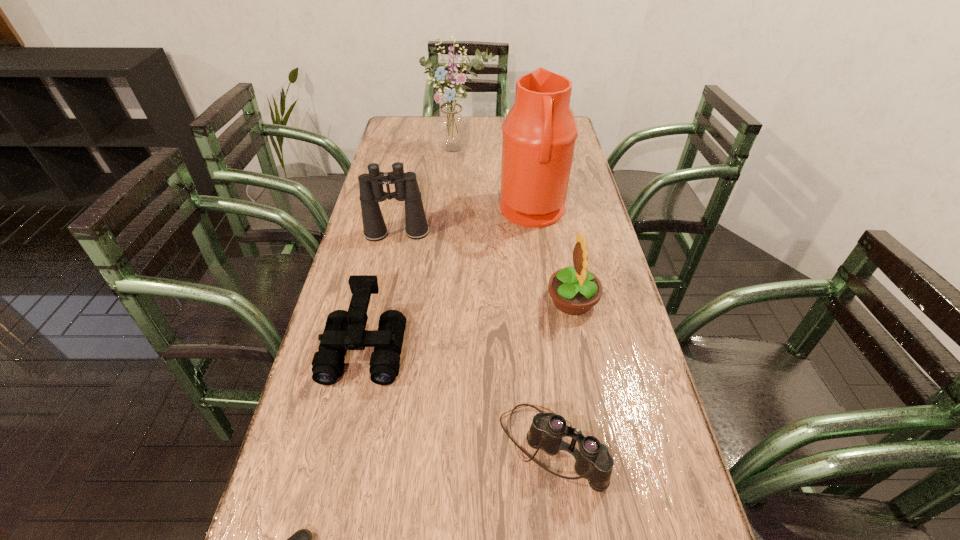
At what (x,y) coordinates should I click in order to perform the action: click on vacant region located from the spout of the water jug. Please return your answer as a coordinate pair (x, y). This screenshot has height=540, width=960. Looking at the image, I should click on (403, 212).

Identify the location of free space located from the spout of the water jug. This screenshot has width=960, height=540. (x=446, y=212).

You are a GUI agent. You are given a task and a screenshot of the screen. Output one action in this format:
    pyautogui.click(x=<x>, y=<y>)
    Task: Click on the vacant position located 0.070m on the front of the tallest binoculars
    This screenshot has width=960, height=540.
    Given the screenshot: What is the action you would take?
    pyautogui.click(x=392, y=258)

You are a GUI agent. You are given a task and a screenshot of the screen. Output one action in this format:
    pyautogui.click(x=<x>, y=<y>)
    Task: Click on the free region located 0.300m on the face of the sunflower
    The height and width of the screenshot is (540, 960).
    Given the screenshot: What is the action you would take?
    pyautogui.click(x=432, y=300)

Where is `vacant space located 0.170m on the face of the sunflower`? vacant space located 0.170m on the face of the sunflower is located at coordinates (481, 300).

Identify the location of free region located on the face of the sunflower. This screenshot has width=960, height=540. (473, 300).

Find the location of a particular element. free space located on the front lenses of the second farthest binoculars is located at coordinates (349, 416).

Locate an element on the screen. vacant point located 0.340m on the left of the nearest binoculars is located at coordinates (329, 447).

Locate an element on the screen. The image size is (960, 540). object situated at the far edge is located at coordinates click(451, 125).

At what (x,y) coordinates should I click in order to perform the action: click on water jug at the right edge. Please return your answer as a coordinate pair (x, y). This screenshot has width=960, height=540. Looking at the image, I should click on (539, 133).